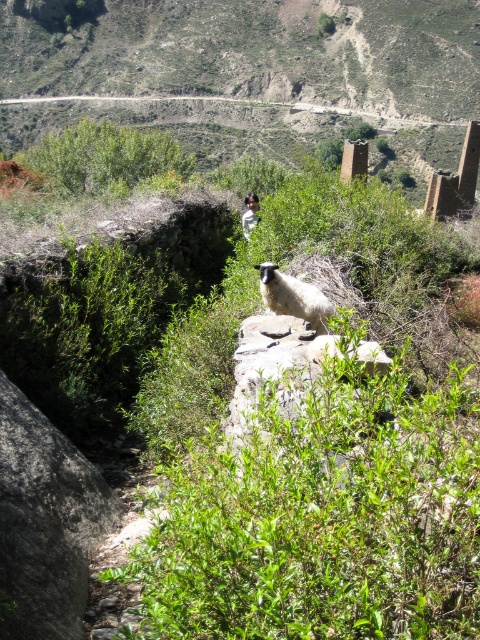
You are a hiker trying to locate the white woolly sheep at center in the distance. There is a green leafy bush at upper center in your line of sight. How far apart are these two landmarks?

The green leafy bush at upper center and the white woolly sheep at center are 27.42 meters apart.

You are navigating a drone through the rural landscape shown in the image. You need to fly from point A at coordinates point (389, 403) to point B at coordinates point (44, 173). Based on the spatial relationship between these points, will you fly towards or away from the sheep?

Point (389, 403) is in front of point (44, 173). Since the sheep is in the middle ground facing slightly towards the camera, flying from point A to point B would mean moving towards the sheep as point A is closer to the sheep than point B.